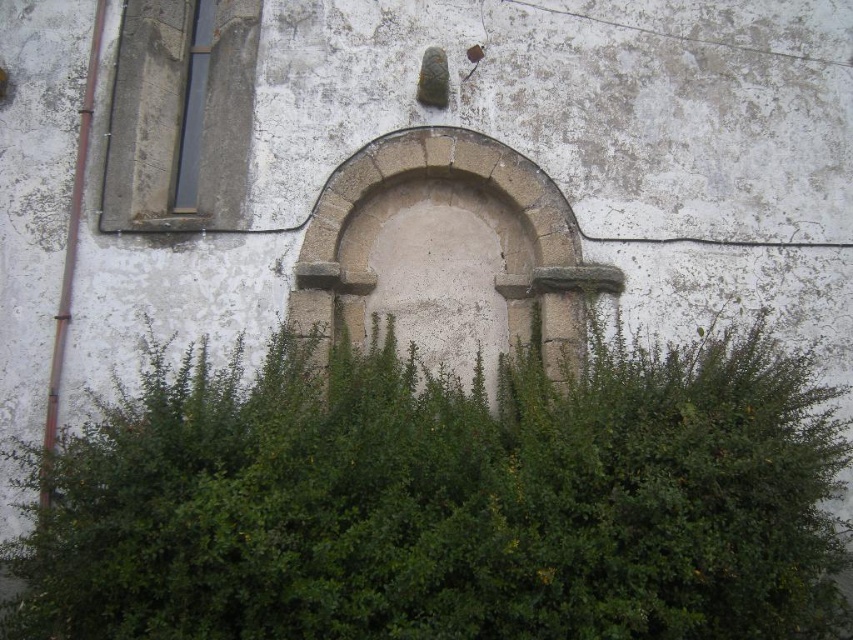
You are standing in front of the old stone wall and want to touch the windows. Which window, the matte concrete window at upper left or the smooth glass window at upper left, can you reach first without moving your position?

The matte concrete window at upper left is closer to the viewer than the smooth glass window at upper left, so you can reach the matte concrete window at upper left first without moving.

You are standing in front of the old stone wall and notice both the green leafy hedge at center and the stone archway at center. Which object is positioned lower in relation to the other?

The green leafy hedge at center is below the stone archway at center, so it is positioned lower.

You are standing in front of an old stone wall and notice a green leafy hedge at center and a smooth glass window at upper left. Which object is positioned to the right of the other?

The green leafy hedge at center is positioned to the right of the smooth glass window at upper left.